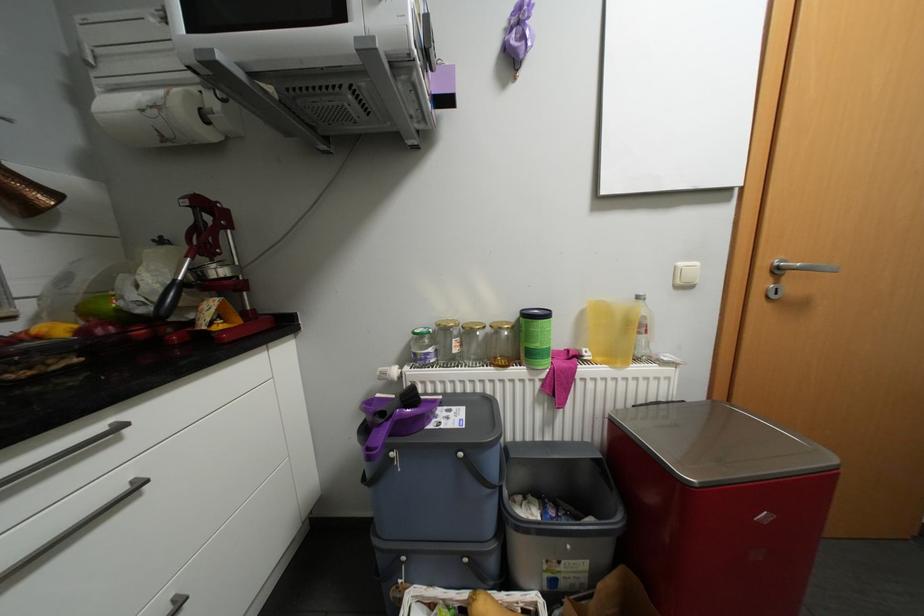
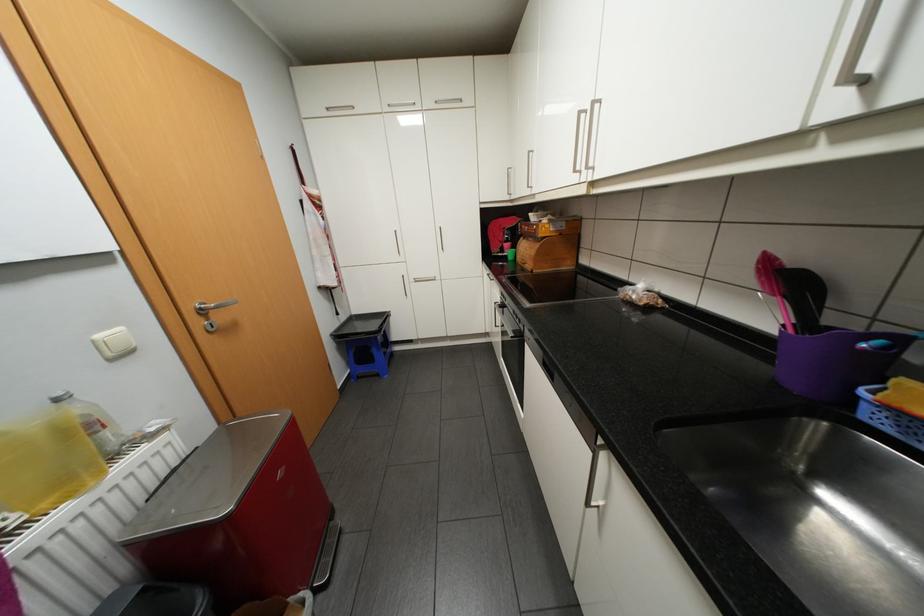
Where in the second image is the point corresponding to point 606,358 from the first image?

(53, 504)